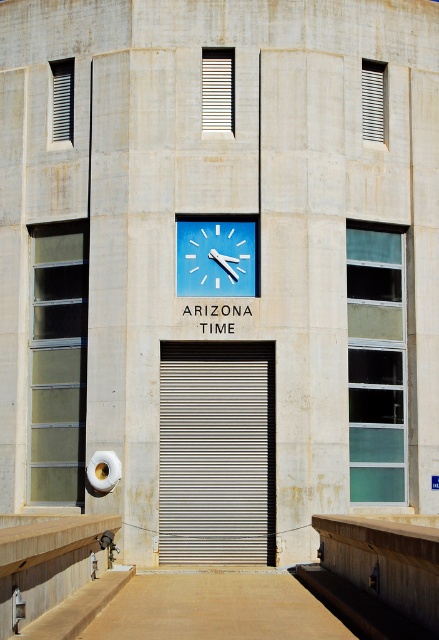
Question: Does metallic silver garage door at center appear on the left side of brown concrete ramp at center?

Choices:
 (A) no
 (B) yes

Answer: (B)

Question: Does metallic silver garage door at center appear on the left side of brown concrete ramp at center?

Choices:
 (A) yes
 (B) no

Answer: (A)

Question: Which is nearer to the blue plastic clock at center?

Choices:
 (A) metallic silver garage door at center
 (B) wooden at center

Answer: (A)

Question: Considering the relative positions of metallic silver garage door at center and blue plastic clock at center in the image provided, where is metallic silver garage door at center located with respect to blue plastic clock at center?

Choices:
 (A) above
 (B) below

Answer: (B)

Question: Which point is farther to the camera?

Choices:
 (A) (248, 289)
 (B) (238, 378)
 (C) (220, 577)

Answer: (B)

Question: Which point is closer to the camera taking this photo?

Choices:
 (A) (413, 620)
 (B) (195, 449)

Answer: (A)